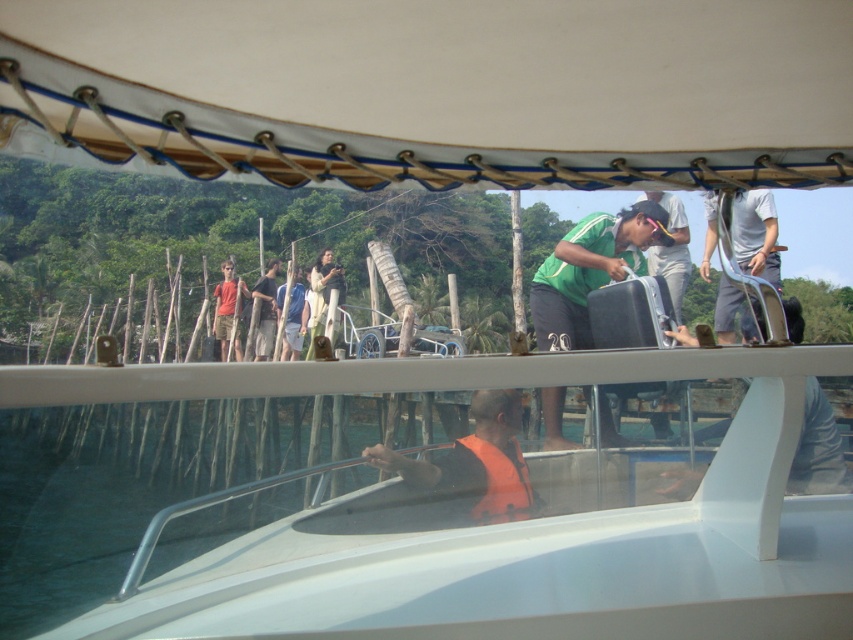
Measure the distance from white fabric canopy at upper center to green fabric shirt at center.

white fabric canopy at upper center is 9.25 feet from green fabric shirt at center.

Image resolution: width=853 pixels, height=640 pixels. In order to click on white fabric canopy at upper center in this screenshot , I will do `click(444, 88)`.

Locate an element on the screen. The image size is (853, 640). white fabric canopy at upper center is located at coordinates (444, 88).

Who is taller, white fabric canopy at upper center or blue fabric shirt at upper center?

Standing taller between the two is blue fabric shirt at upper center.

Is point (241, 12) closer to viewer compared to point (297, 333)?

Yes, it is.

This screenshot has width=853, height=640. What are the coordinates of `white fabric canopy at upper center` in the screenshot? It's located at (444, 88).

Which of these two, green matte shirt at upper center or orange cotton shirt at left, stands shorter?

With less height is green matte shirt at upper center.

Can you confirm if green matte shirt at upper center is bigger than orange cotton shirt at left?

No, green matte shirt at upper center is not bigger than orange cotton shirt at left.

Where is `green matte shirt at upper center`? Image resolution: width=853 pixels, height=640 pixels. green matte shirt at upper center is located at coordinates (671, 250).